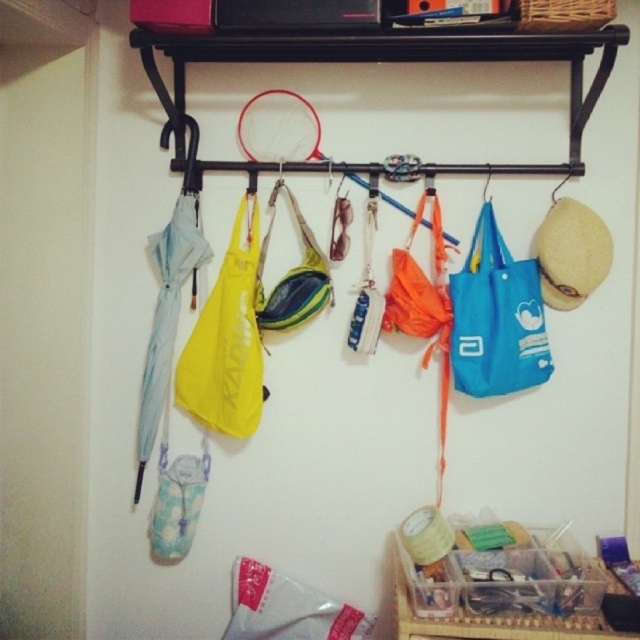
Question: Which is nearer to the clear plastic container at lower center?

Choices:
 (A) black metal shelf at upper center
 (B) yellow fabric pouch at center
 (C) yellow fabric bag at center

Answer: (C)

Question: Is yellow fabric bag at center positioned before yellow fabric pouch at center?

Choices:
 (A) yes
 (B) no

Answer: (B)

Question: Is black metal shelf at upper center wider than blue fabric bag at center-right?

Choices:
 (A) yes
 (B) no

Answer: (A)

Question: Estimate the real-world distances between objects in this image. Which object is farther from the yellow fabric bag at center?

Choices:
 (A) clear plastic container at lower center
 (B) black metal shelf at upper center
 (C) yellow fabric pouch at center
 (D) blue fabric bag at center-right

Answer: (A)

Question: Which of the following is the farthest from the observer?

Choices:
 (A) yellow fabric pouch at center
 (B) yellow fabric bag at center
 (C) blue fabric bag at center-right
 (D) clear plastic container at lower center

Answer: (B)

Question: Is yellow fabric bag at center to the right of yellow fabric pouch at center from the viewer's perspective?

Choices:
 (A) no
 (B) yes

Answer: (A)